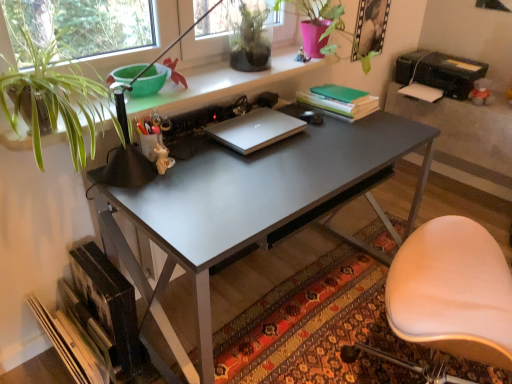
Question: Is the depth of green matte plant at upper center, which ranks as the 1th houseplant in top-to-bottom order, greater than that of silver metallic laptop at center?

Choices:
 (A) no
 (B) yes

Answer: (B)

Question: Can you confirm if green matte plant at upper center, which appears as the second houseplant when viewed from the left, is taller than silver metallic laptop at center?

Choices:
 (A) no
 (B) yes

Answer: (B)

Question: Is there a large distance between green matte plant at upper center, which appears as the 2th houseplant when ordered from the bottom, and silver metallic laptop at center?

Choices:
 (A) no
 (B) yes

Answer: (A)

Question: Is green matte plant at upper center, which appears as the 2th houseplant when ordered from the bottom, outside silver metallic laptop at center?

Choices:
 (A) yes
 (B) no

Answer: (A)

Question: From a real-world perspective, is green matte plant at upper center, which ranks as the 1th houseplant in top-to-bottom order, physically above silver metallic laptop at center?

Choices:
 (A) no
 (B) yes

Answer: (B)

Question: Visually, is black plastic printer at upper right positioned to the left or to the right of green leafy plant at upper left, arranged as the first houseplant when viewed from the front?

Choices:
 (A) left
 (B) right

Answer: (B)

Question: Is black plastic printer at upper right inside the boundaries of green leafy plant at upper left, the first houseplant positioned from the bottom, or outside?

Choices:
 (A) outside
 (B) inside

Answer: (A)

Question: From a real-world perspective, is black plastic printer at upper right above or below green leafy plant at upper left, arranged as the first houseplant when viewed from the front?

Choices:
 (A) above
 (B) below

Answer: (B)

Question: Does point (483, 114) appear closer or farther from the camera than point (54, 69)?

Choices:
 (A) closer
 (B) farther

Answer: (B)

Question: Is carpeted rug at lower center spatially inside hardcover books at lower left, the 2th book in the right-to-left sequence, or outside of it?

Choices:
 (A) inside
 (B) outside

Answer: (B)

Question: Is point (243, 322) closer or farther from the camera than point (124, 288)?

Choices:
 (A) farther
 (B) closer

Answer: (A)

Question: From the image's perspective, is carpeted rug at lower center positioned above or below hardcover books at lower left, the 2th book in the right-to-left sequence?

Choices:
 (A) above
 (B) below

Answer: (B)

Question: From a real-world perspective, is carpeted rug at lower center physically located above or below hardcover books at lower left, which is the second book in top-to-bottom order?

Choices:
 (A) below
 (B) above

Answer: (A)

Question: Would you say black plastic printer at upper right is inside or outside white leather chair at lower right?

Choices:
 (A) outside
 (B) inside

Answer: (A)

Question: Visually, is black plastic printer at upper right positioned to the left or to the right of white leather chair at lower right?

Choices:
 (A) left
 (B) right

Answer: (B)